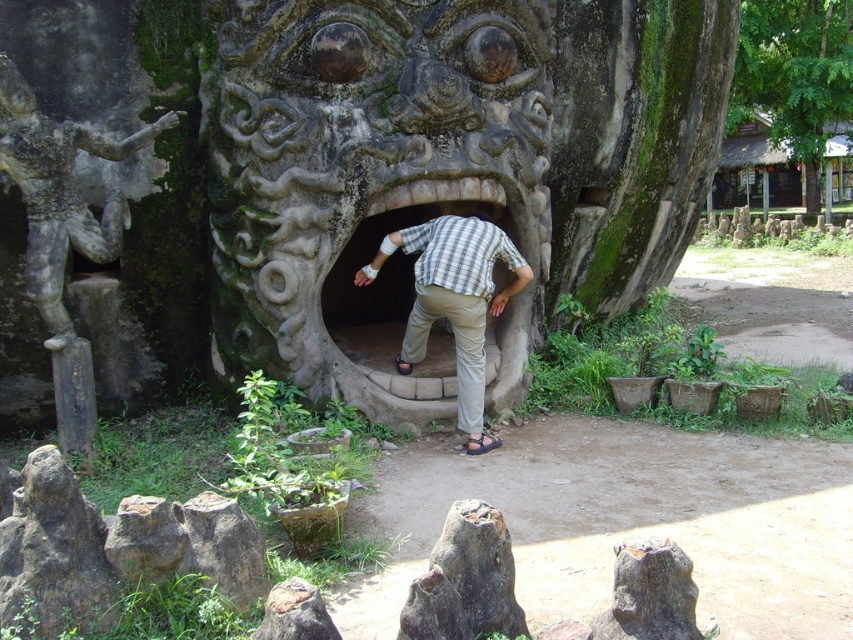
You are a tour guide explaining the ancient stone structure to visitors. You point to the stone textured face at center and the brown leather sandal at center. Which object is taller according to the scene?

The stone textured face at center is taller than the brown leather sandal at center.

You are standing at the entrance of the tunnel in front of the stone face. You see two points marked on the structure. The first point is at coordinates point (41, 184) and the second is at point (752, 44). Which point is closer to you?

The point at coordinates point (41, 184) is closer to you than the point at point (752, 44).

You are standing at the entrance of the tunnel near the monstrous stone face. You notice two points marked on the ground ahead of you. One is at coordinates point (x=543, y=250) and the other at point (x=480, y=445). If you were to walk straight from your current position towards the monstrous face, which point would you step on first?

Point (x=480, y=445) would be stepped on first because it is in front of point (x=543, y=250) according to their positions.